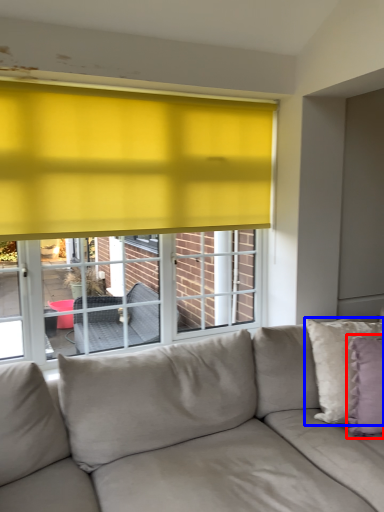
Question: Which of the following is the farthest to the observer, pillow (highlighted by a red box) or pillow (highlighted by a blue box)?

Choices:
 (A) pillow
 (B) pillow

Answer: (B)